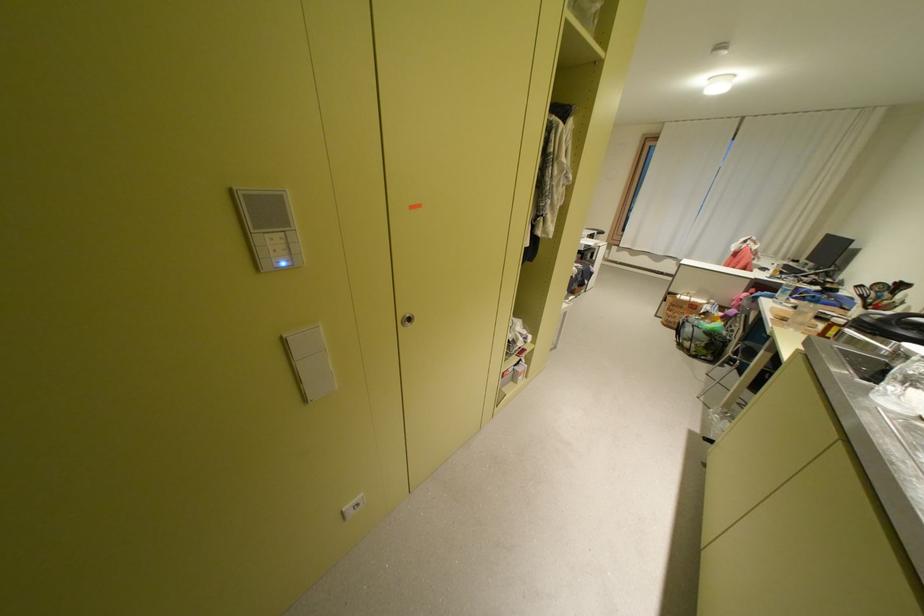
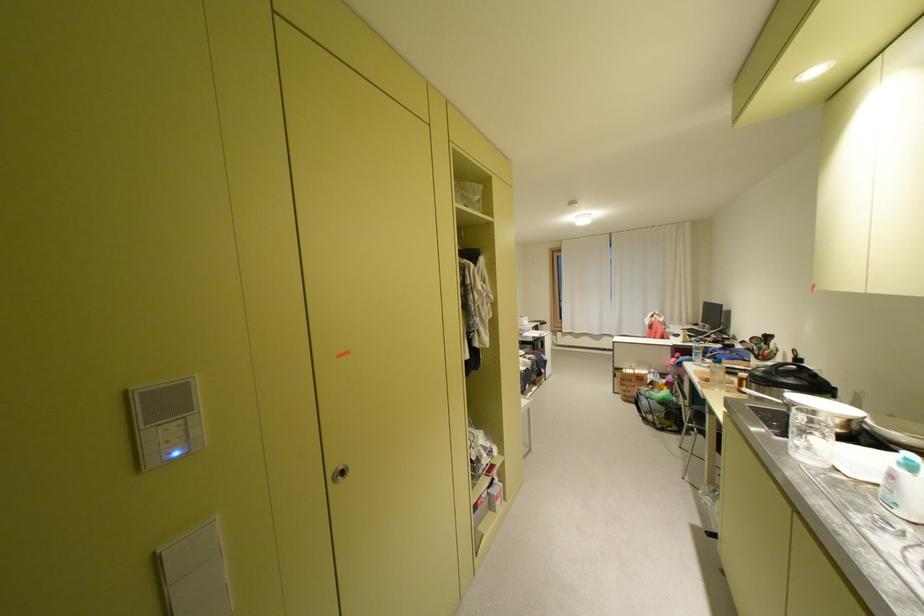
Locate, in the second image, the point that corresponds to pixel 295 337 in the first image.

(169, 552)